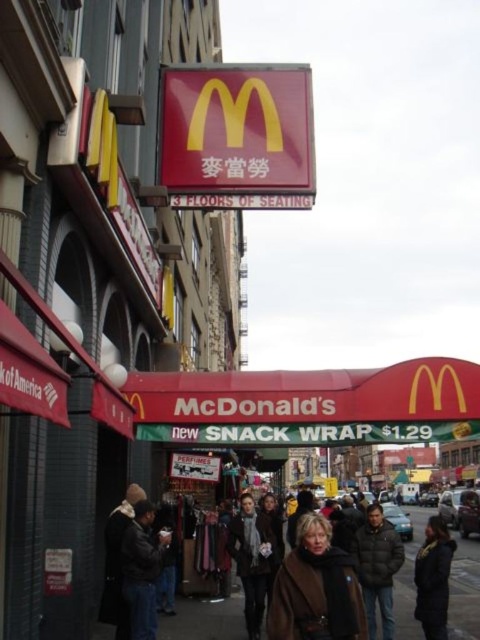
Question: Which point is farther to the camera?

Choices:
 (A) (195, 602)
 (B) (386, 634)
 (C) (350, 621)

Answer: (A)

Question: Which object is positioned closest to the dark gray scarf at center?

Choices:
 (A) dark brown leather jacket at lower right
 (B) matte plastic sign at center
 (C) brown leather jacket at lower center

Answer: (C)

Question: Does brown leather coat at center come behind metallic silver sign at center?

Choices:
 (A) no
 (B) yes

Answer: (A)

Question: Is matte plastic sign at center thinner than dark brown leather jacket at lower right?

Choices:
 (A) no
 (B) yes

Answer: (A)

Question: Is black leather jacket at lower left thinner than metallic silver sign at center?

Choices:
 (A) yes
 (B) no

Answer: (A)

Question: Which point is closer to the camera taking this photo?

Choices:
 (A) (325, 616)
 (B) (133, 579)
 (C) (235, 163)

Answer: (A)